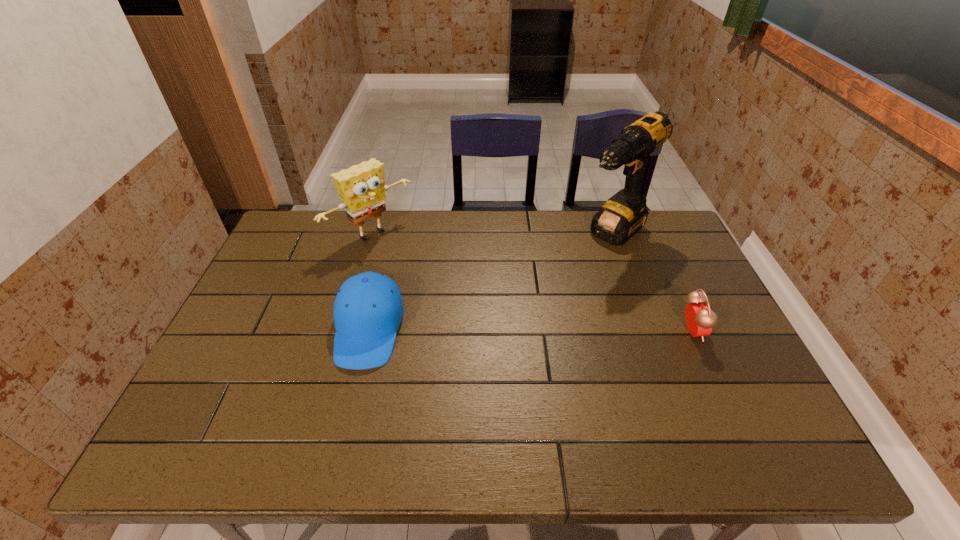
Identify the location of free space between the alarm clock and the cap. Image resolution: width=960 pixels, height=540 pixels. (530, 330).

The image size is (960, 540). I want to click on free space between the third shortest object and the alarm clock, so click(x=532, y=283).

Choose which object is the nearest neighbor to the sponge. Please provide its 2D coordinates. Your answer should be formatted as a tuple, i.e. [(x, y)], where the tuple contains the x and y coordinates of a point satisfying the conditions above.

[(368, 310)]

Locate an element on the screen. the third closest object relative to the alarm clock is located at coordinates (362, 188).

Identify the location of free space that satisfies the following two spatial constraints: 1. on the front-facing side of the alarm clock; 2. on the clock face of the cap. Image resolution: width=960 pixels, height=540 pixels. (369, 331).

Locate an element on the screen. This screenshot has width=960, height=540. vacant region that satisfies the following two spatial constraints: 1. on the front side of the alarm clock; 2. on the clock face of the sponge is located at coordinates (345, 331).

This screenshot has width=960, height=540. In order to click on free spot that satisfies the following two spatial constraints: 1. on the front side of the second tallest object; 2. on the left side of the drill in this screenshot , I will do `click(372, 235)`.

The image size is (960, 540). Identify the location of vacant area that satisfies the following two spatial constraints: 1. on the front-facing side of the alarm clock; 2. on the clock face of the cap. (369, 331).

I want to click on vacant space that satisfies the following two spatial constraints: 1. on the front side of the sponge; 2. on the clock face of the alarm clock, so click(x=345, y=331).

This screenshot has width=960, height=540. I want to click on vacant point that satisfies the following two spatial constraints: 1. on the front side of the drill; 2. on the clock face of the alarm clock, so click(647, 331).